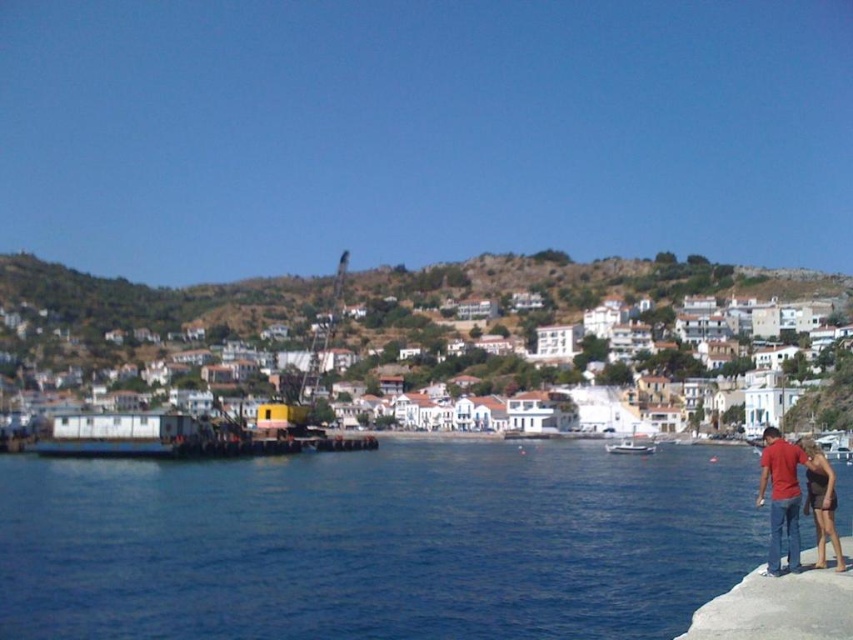
Question: Is blue water at lower left below matte red shirt at lower right?

Choices:
 (A) no
 (B) yes

Answer: (B)

Question: Can you confirm if blue water at lower left is positioned below matte red shirt at lower right?

Choices:
 (A) yes
 (B) no

Answer: (A)

Question: Which object is positioned farthest from the matte red shirt at lower right?

Choices:
 (A) white matte boat at center
 (B) blue water at lower left
 (C) white matte buildings at center

Answer: (C)

Question: Does white matte buildings at center appear on the left side of matte red shirt at lower right?

Choices:
 (A) no
 (B) yes

Answer: (B)

Question: Which point is closer to the camera taking this photo?

Choices:
 (A) (819, 541)
 (B) (86, 310)
 (C) (344, 512)

Answer: (A)

Question: Among these objects, which one is farthest from the camera?

Choices:
 (A) matte red shirt at lower right
 (B) white matte boat at center

Answer: (B)